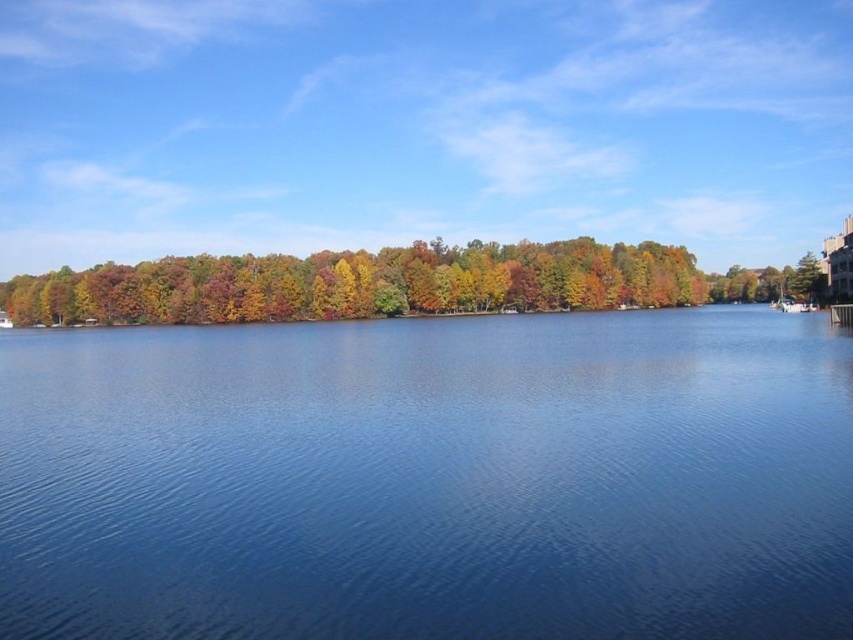
You are standing on the lakeside and want to row from the blue water at center to the white plastic boat at right. Given that your rowing speed is 2 meters per second, how long will it take you to reach the boat?

The distance between the blue water at center and the white plastic boat at right is 74.76 meters. At a rowing speed of 2 meters per second, it will take approximately 37.38 seconds to reach the boat.

You are standing at the point labeled as point [430,480] in the image. What is directly beneath your feet?

The point labeled as point [430,480] is directly beneath your feet, indicating blue water at center.

You are standing at the edge of the lake and want to locate the blue water at center. According to the coordinates provided, where exactly would you find it?

The blue water at center is located at the coordinates point (430, 480).